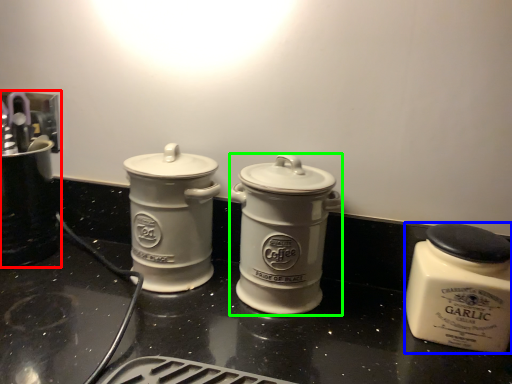
Question: Which object is positioned farthest from appliance (highlighted by a red box)? Select from kitchen appliance (highlighted by a blue box) and kitchen appliance (highlighted by a green box).

Choices:
 (A) kitchen appliance
 (B) kitchen appliance

Answer: (A)